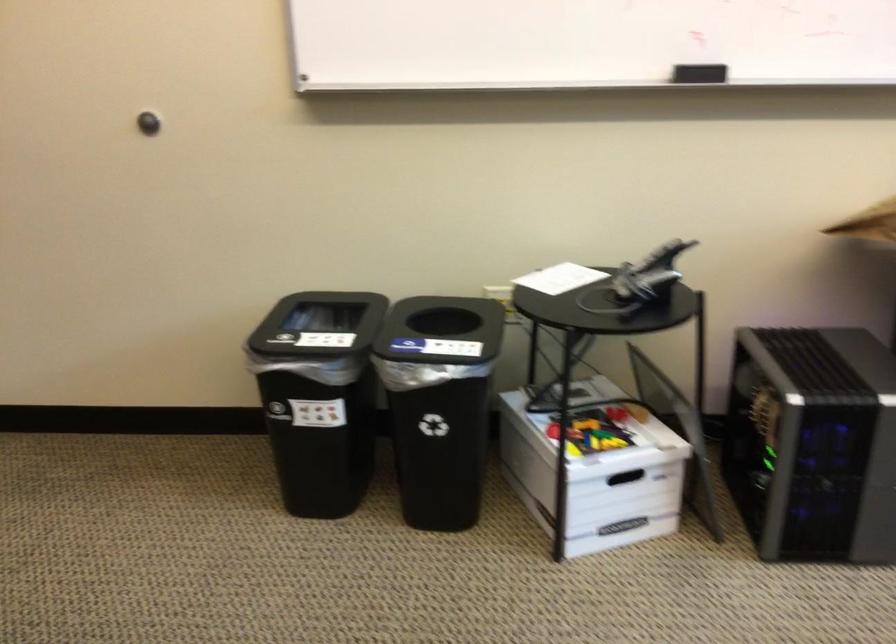
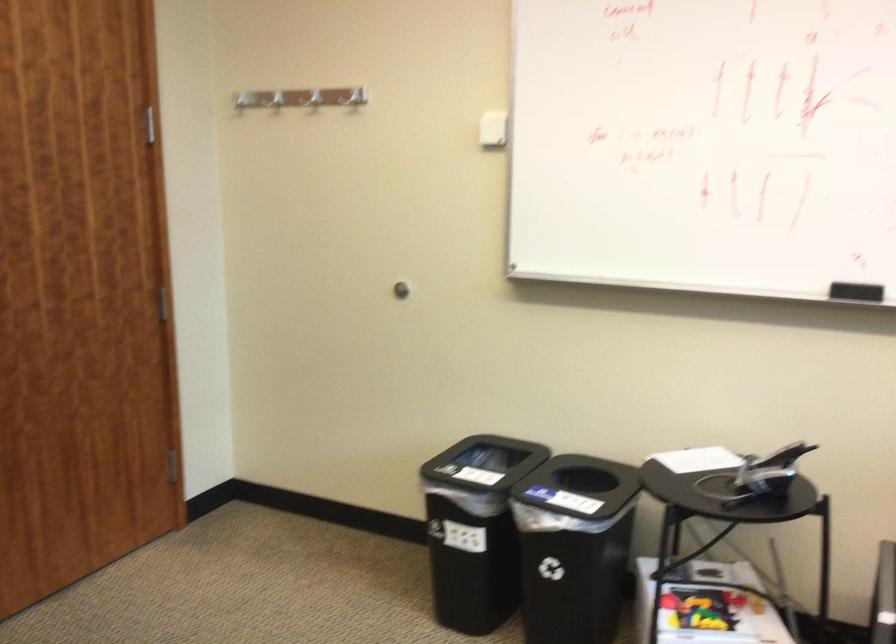
Find the pixel in the second image that matches the point at 703,79 in the first image.

(856, 292)